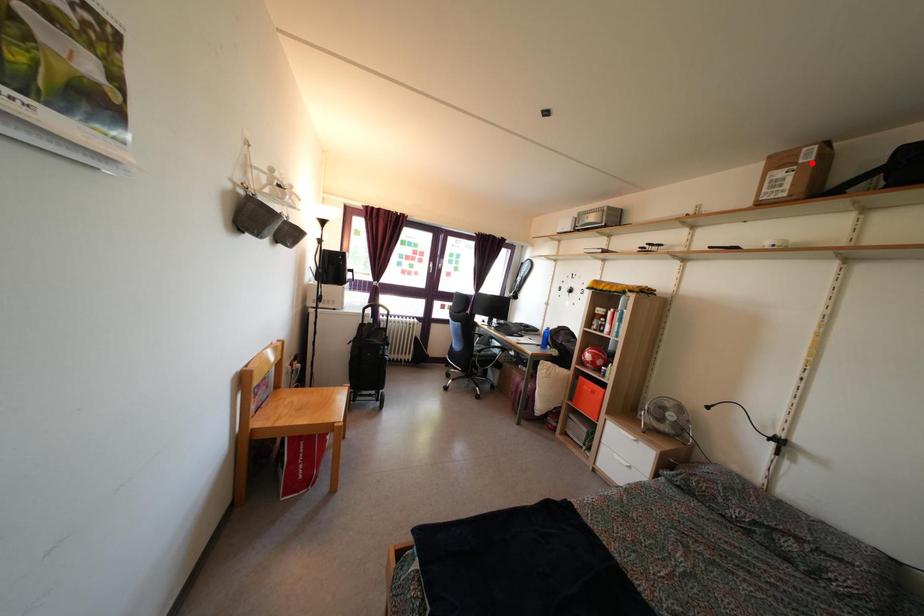
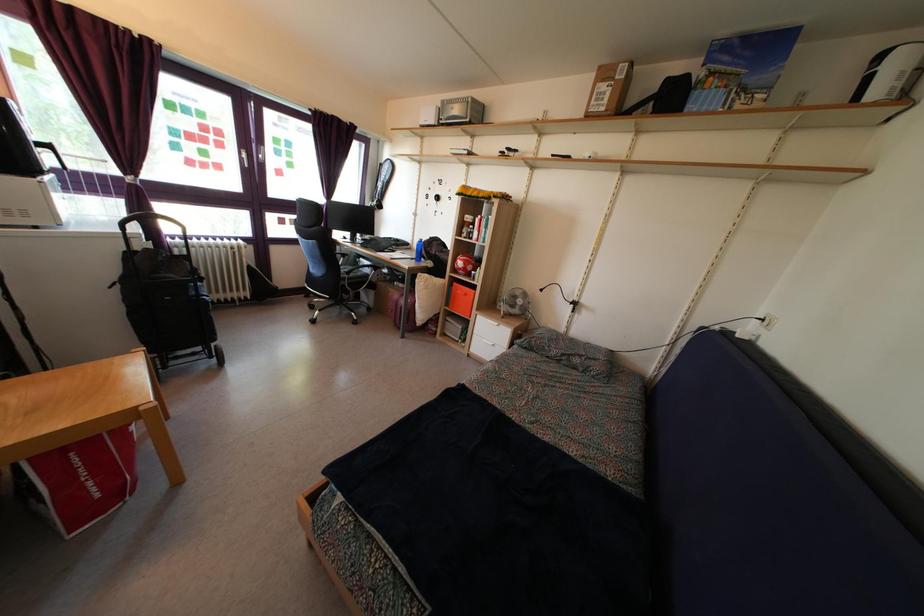
The point at the highlighted location is marked in the first image. Where is the corresponding point in the second image?

(624, 79)